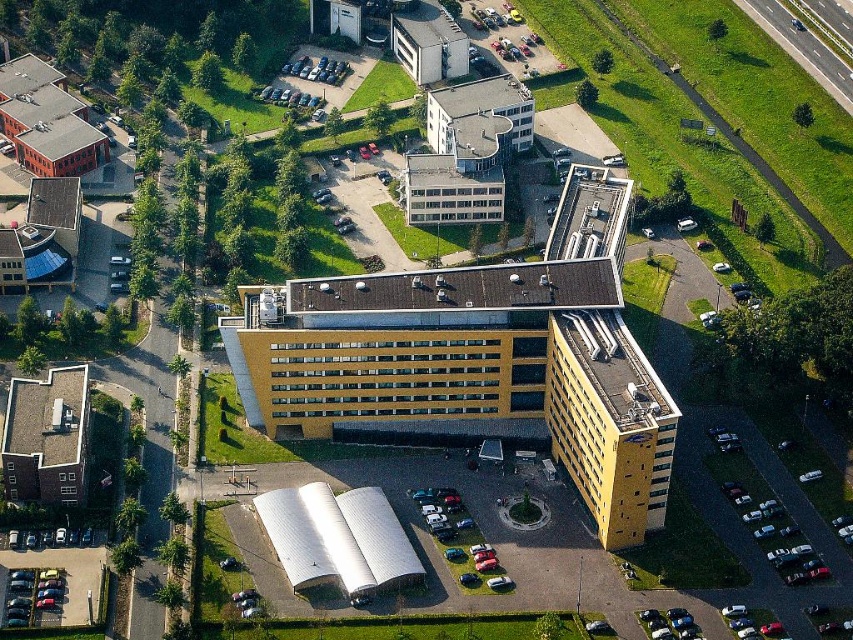
Image resolution: width=853 pixels, height=640 pixels. Find the location of `green grass at upper right`. green grass at upper right is located at coordinates (796, 54).

Who is shorter, green grass at upper right or silver metallic antenna at lower center?

With less height is silver metallic antenna at lower center.

Does point (770, 26) come behind point (576, 580)?

Yes, it is behind point (576, 580).

The width and height of the screenshot is (853, 640). Find the location of `green grass at upper right`. green grass at upper right is located at coordinates (796, 54).